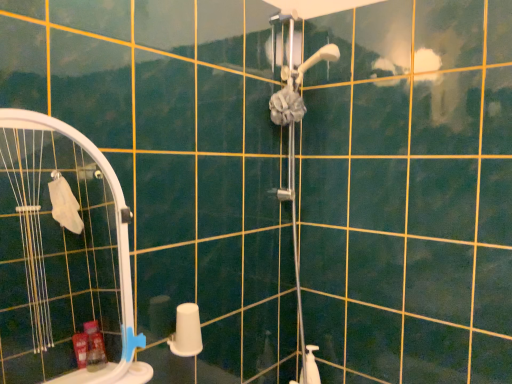
This screenshot has height=384, width=512. What are the coordinates of `matte gray shower door at upper center` in the screenshot? It's located at (294, 141).

From a real-world perspective, is white matte toilet paper at lower center physically above blue plastic towel bar at lower left?

No, from a real-world perspective, white matte toilet paper at lower center is not over blue plastic towel bar at lower left

Is white matte toilet paper at lower center turned away from blue plastic towel bar at lower left?

No, white matte toilet paper at lower center is not facing the opposite direction of blue plastic towel bar at lower left.

Based on their sizes in the image, would you say white matte toilet paper at lower center is bigger or smaller than blue plastic towel bar at lower left?

Considering their sizes, white matte toilet paper at lower center takes up more space than blue plastic towel bar at lower left.

Who is shorter, matte gray shower door at upper center or blue plastic towel bar at lower left?

blue plastic towel bar at lower left.

Does point (298, 97) come behind point (144, 335)?

Yes.

Could you tell me if matte gray shower door at upper center is facing blue plastic towel bar at lower left?

No, matte gray shower door at upper center is not aimed at blue plastic towel bar at lower left.

From the image's perspective, is matte gray shower door at upper center located above blue plastic towel bar at lower left?

Correct, matte gray shower door at upper center appears higher than blue plastic towel bar at lower left in the image.

From a real-world perspective, is blue plastic towel bar at lower left physically above white plastic screen door at left?

No, from a real-world perspective, blue plastic towel bar at lower left is not on top of white plastic screen door at left.

What's the angular difference between blue plastic towel bar at lower left and white plastic screen door at left's facing directions?

There is a 1.35-degree angle between the facing directions of blue plastic towel bar at lower left and white plastic screen door at left.

Looking at this image, based on their positions, is blue plastic towel bar at lower left located to the left or right of white plastic screen door at left?

blue plastic towel bar at lower left is positioned on white plastic screen door at left's right side.

Is blue plastic towel bar at lower left thinner than white plastic screen door at left?

Yes.

Is blue plastic towel bar at lower left bigger or smaller than white matte toilet paper at lower center?

Considering their sizes, blue plastic towel bar at lower left takes up less space than white matte toilet paper at lower center.

From the image's perspective, which is below, blue plastic towel bar at lower left or white matte toilet paper at lower center?

From the image's view, blue plastic towel bar at lower left is below.

Consider the image. Can you confirm if matte gray shower door at upper center is shorter than white plastic screen door at left?

Incorrect, the height of matte gray shower door at upper center does not fall short of that of white plastic screen door at left.

Which object is further away from the camera taking this photo, matte gray shower door at upper center or white plastic screen door at left?

matte gray shower door at upper center is more distant.

In terms of size, does matte gray shower door at upper center appear bigger or smaller than white plastic screen door at left?

Considering their sizes, matte gray shower door at upper center takes up more space than white plastic screen door at left.

Is point (289, 169) less distant than point (73, 321)?

Yes, it is.

In terms of height, does white plastic screen door at left look taller or shorter compared to blue plastic towel bar at lower left?

In the image, white plastic screen door at left appears to be taller than blue plastic towel bar at lower left.

Identify the location of screen door above the blue plastic towel bar at lower left (from the image's perspective). The height and width of the screenshot is (384, 512). (62, 258).

Considering the sizes of objects white plastic screen door at left and blue plastic towel bar at lower left in the image provided, who is thinner, white plastic screen door at left or blue plastic towel bar at lower left?

Thinner between the two is blue plastic towel bar at lower left.

Who is bigger, white plastic screen door at left or blue plastic towel bar at lower left?

white plastic screen door at left is bigger.

Which point is more forward, (x=139, y=383) or (x=298, y=264)?

The point (x=139, y=383) is more forward.

From a real-world perspective, which object stands above the other?

Result: matte gray shower door at upper center is physically above.

Considering the positions of objects white plastic screen door at left and matte gray shower door at upper center in the image provided, who is in front, white plastic screen door at left or matte gray shower door at upper center?

white plastic screen door at left.

Find the location of a particular element. Image resolution: width=512 pixels, height=384 pixels. screen door lying below the matte gray shower door at upper center (from the image's perspective) is located at coordinates (62, 258).

Find the location of `toilet paper on the right of blue plastic towel bar at lower left`. toilet paper on the right of blue plastic towel bar at lower left is located at coordinates (186, 331).

Identify the location of towel bar lying in front of the matte gray shower door at upper center. This screenshot has height=384, width=512. click(x=131, y=343).

From the picture: Which object lies nearer to the anchor point white matte toilet paper at lower center, matte gray shower door at upper center or blue plastic towel bar at lower left?

blue plastic towel bar at lower left is closer to white matte toilet paper at lower center.

Which object lies nearer to the anchor point matte gray shower door at upper center, white plastic screen door at left or blue plastic towel bar at lower left?

blue plastic towel bar at lower left.

Which object lies nearer to the anchor point blue plastic towel bar at lower left, white matte toilet paper at lower center or matte gray shower door at upper center?

white matte toilet paper at lower center is positioned closer to the anchor blue plastic towel bar at lower left.

Estimate the real-world distances between objects in this image. Which object is closer to white plastic screen door at left, matte gray shower door at upper center or blue plastic towel bar at lower left?

matte gray shower door at upper center is closer to white plastic screen door at left.

Estimate the real-world distances between objects in this image. Which object is closer to blue plastic towel bar at lower left, matte gray shower door at upper center or white plastic screen door at left?

matte gray shower door at upper center.

Estimate the real-world distances between objects in this image. Which object is closer to matte gray shower door at upper center, white matte toilet paper at lower center or blue plastic towel bar at lower left?

Based on the image, white matte toilet paper at lower center appears to be nearer to matte gray shower door at upper center.

Based on their spatial positions, is blue plastic towel bar at lower left or white matte toilet paper at lower center further from white plastic screen door at left?

blue plastic towel bar at lower left lies further to white plastic screen door at left than the other object.

Which object lies further to the anchor point matte gray shower door at upper center, white matte toilet paper at lower center or white plastic screen door at left?

white plastic screen door at left is further to matte gray shower door at upper center.

This screenshot has height=384, width=512. Find the location of `towel bar located between white plastic screen door at left and white matte toilet paper at lower center in the depth direction`. towel bar located between white plastic screen door at left and white matte toilet paper at lower center in the depth direction is located at coordinates (131, 343).

I want to click on toilet paper between blue plastic towel bar at lower left and matte gray shower door at upper center from left to right, so click(x=186, y=331).

Locate an element on the screen. This screenshot has height=384, width=512. towel bar between white plastic screen door at left and matte gray shower door at upper center from left to right is located at coordinates click(x=131, y=343).

Locate an element on the screen. toilet paper located between white plastic screen door at left and matte gray shower door at upper center in the left-right direction is located at coordinates (186, 331).